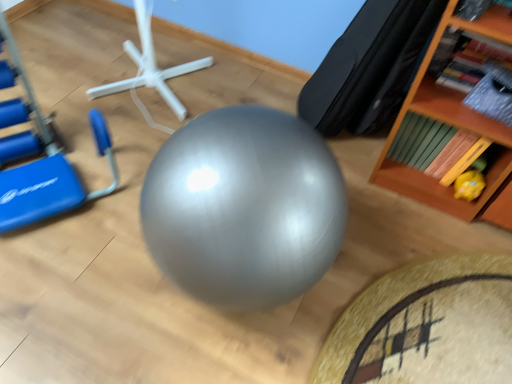
Locate an element on the screen. The image size is (512, 384). free space to the back side of blue plastic swivel chair at left is located at coordinates (50, 92).